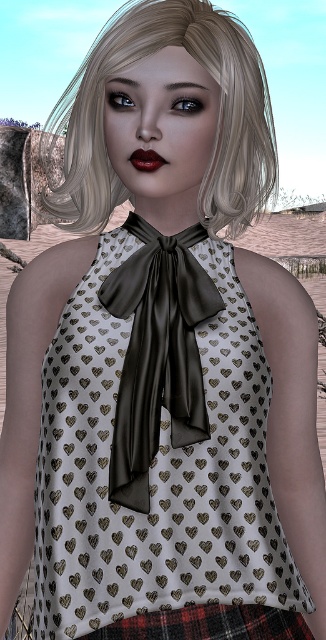
Is point (196, 49) positioned in front of point (174, 333)?

Yes, it is.

Does blonde silky hair at upper center appear under satin black bow tie at center?

Actually, blonde silky hair at upper center is above satin black bow tie at center.

Measure the distance between blonde silky hair at upper center and camera.

A distance of 1.08 meters exists between blonde silky hair at upper center and camera.

Locate an element on the screen. blonde silky hair at upper center is located at coordinates (217, 124).

Locate an element on the screen. This screenshot has width=326, height=640. white satin dress at center is located at coordinates (154, 470).

From the picture: Who is positioned more to the right, white satin dress at center or satin black bow tie at center?

white satin dress at center is more to the right.

Is point (75, 605) closer to viewer compared to point (124, 472)?

Yes.

This screenshot has height=640, width=326. I want to click on white satin dress at center, so click(x=154, y=470).

Which is in front, point (130, 481) or point (273, 616)?

Point (130, 481)

Is satin black bow tie at center wider than red plaid skirt at lower center?

In fact, satin black bow tie at center might be narrower than red plaid skirt at lower center.

Locate an element on the screen. Image resolution: width=326 pixels, height=640 pixels. satin black bow tie at center is located at coordinates (157, 353).